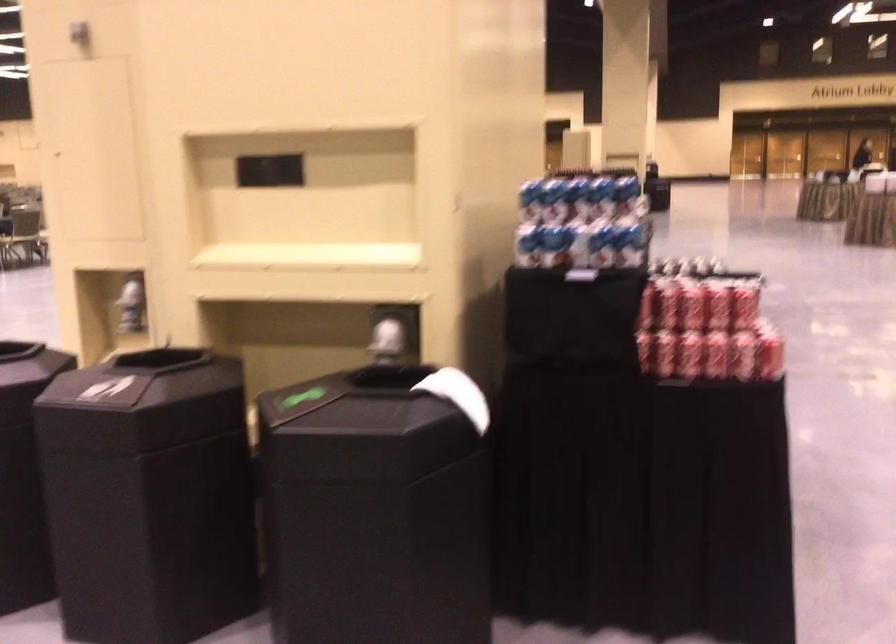
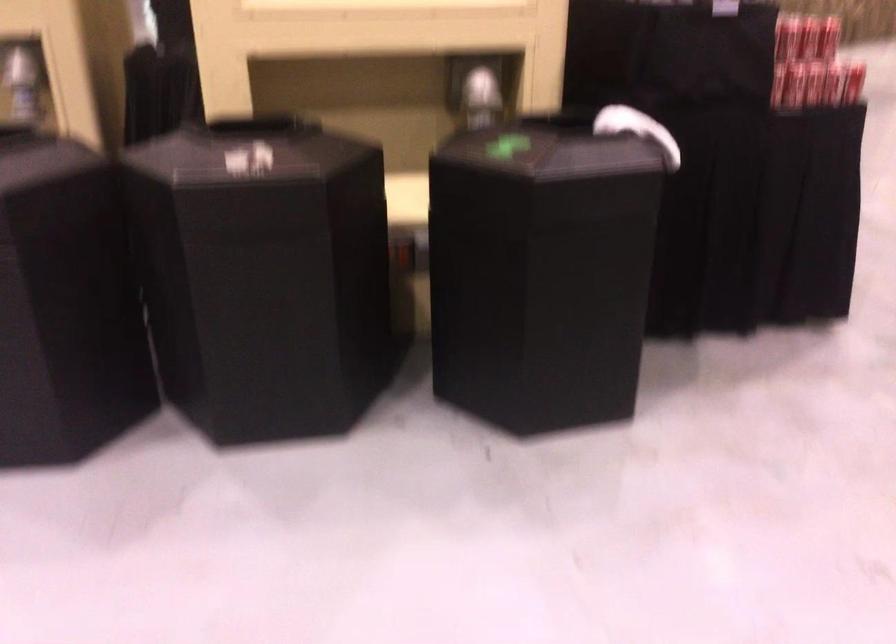
The point at (685,360) is marked in the first image. Where is the corresponding point in the second image?

(810, 84)